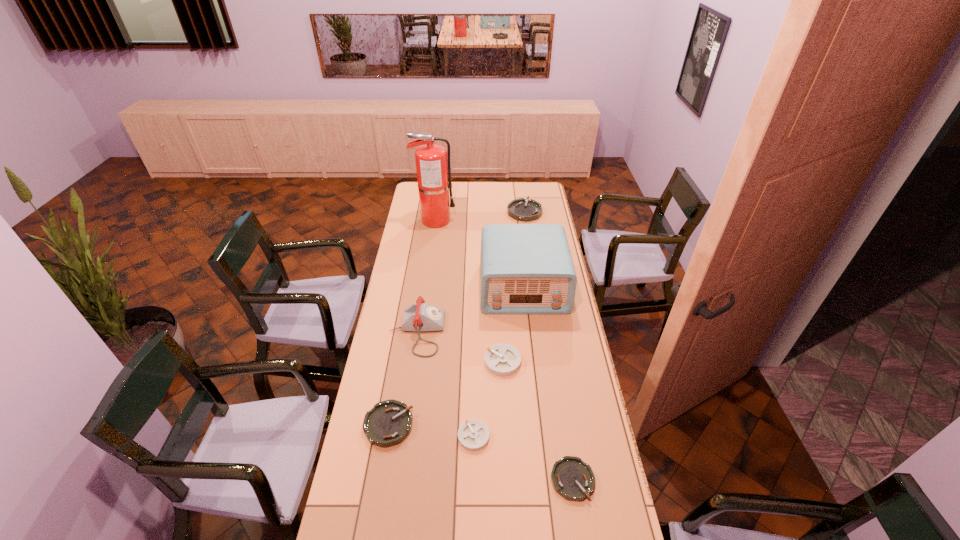
What are the coordinates of `vacant space that satisfies the following two spatial constraints: 1. on the front panel of the radio receiver; 2. on the right side of the nearest ashtray` in the screenshot? It's located at (544, 480).